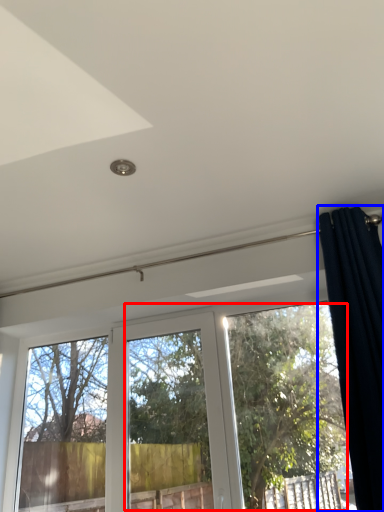
Question: Which object appears closest to the camera in this image, tree (highlighted by a red box) or curtain (highlighted by a blue box)?

Choices:
 (A) tree
 (B) curtain

Answer: (B)